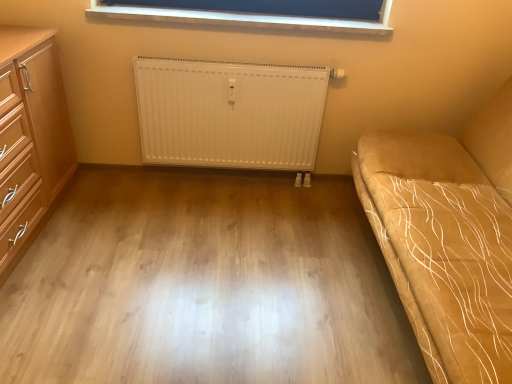
Question: From a real-world perspective, is light wood/wooden chest of drawers at left physically located above or below blue fabric at upper center?

Choices:
 (A) above
 (B) below

Answer: (B)

Question: Based on their sizes in the image, would you say light wood/wooden chest of drawers at left is bigger or smaller than blue fabric at upper center?

Choices:
 (A) big
 (B) small

Answer: (A)

Question: Which object is the closest to the suede-like beige studio couch at right?

Choices:
 (A) white ribbed radiator at center
 (B) light wood floor at center
 (C) light wood/wooden chest of drawers at left
 (D) blue fabric at upper center

Answer: (B)

Question: Which object is positioned farthest from the blue fabric at upper center?

Choices:
 (A) light wood/wooden chest of drawers at left
 (B) light wood floor at center
 (C) white ribbed radiator at center
 (D) suede-like beige studio couch at right

Answer: (B)